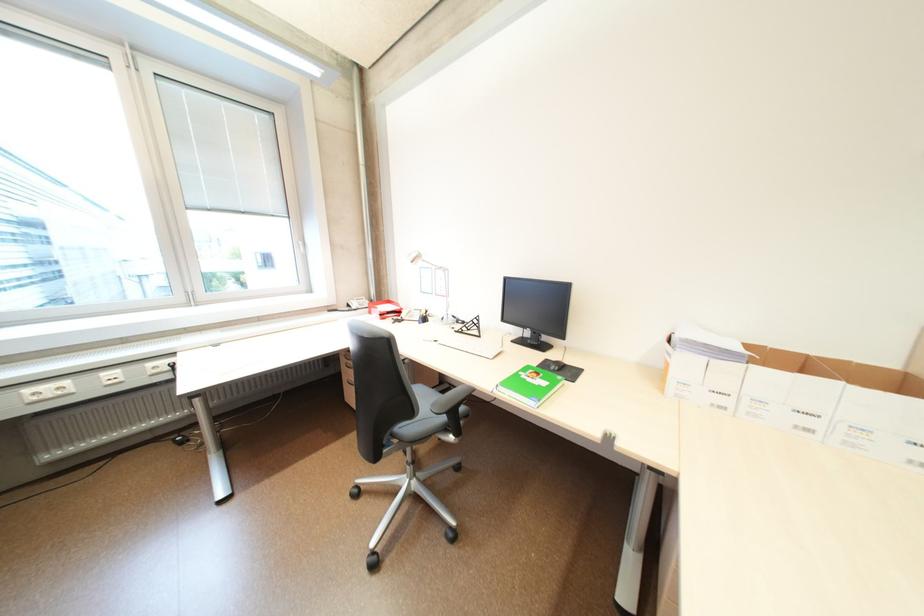
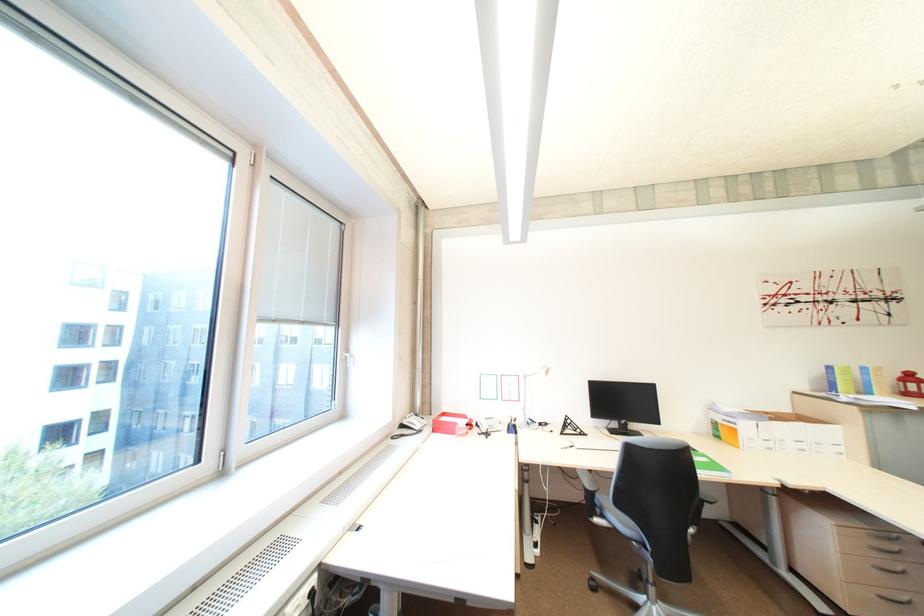
In the second image, find the point that corresponds to point (358, 306) in the first image.

(410, 427)